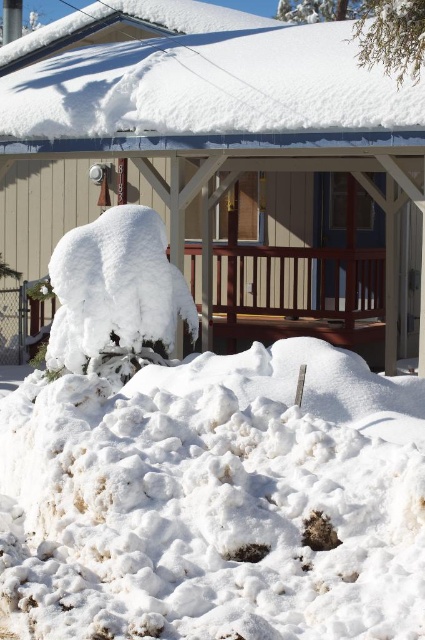
Question: Which object is closer to the camera taking this photo?

Choices:
 (A) white fluffy snow at lower center
 (B) white fluffy snow at center

Answer: (A)

Question: Does white fluffy snow at lower center appear on the right side of white fluffy snow at center?

Choices:
 (A) yes
 (B) no

Answer: (A)

Question: Among these points, which one is nearest to the camera?

Choices:
 (A) (379, 205)
 (B) (401, 416)

Answer: (B)

Question: Which point appears closest to the camera in this image?

Choices:
 (A) (107, 516)
 (B) (36, 72)

Answer: (A)

Question: From the image, what is the correct spatial relationship of white fluffy snow at lower center in relation to white fluffy snow at center?

Choices:
 (A) above
 (B) below

Answer: (B)

Question: Does white fluffy snow at lower center appear on the left side of white fluffy snow at center?

Choices:
 (A) yes
 (B) no

Answer: (B)